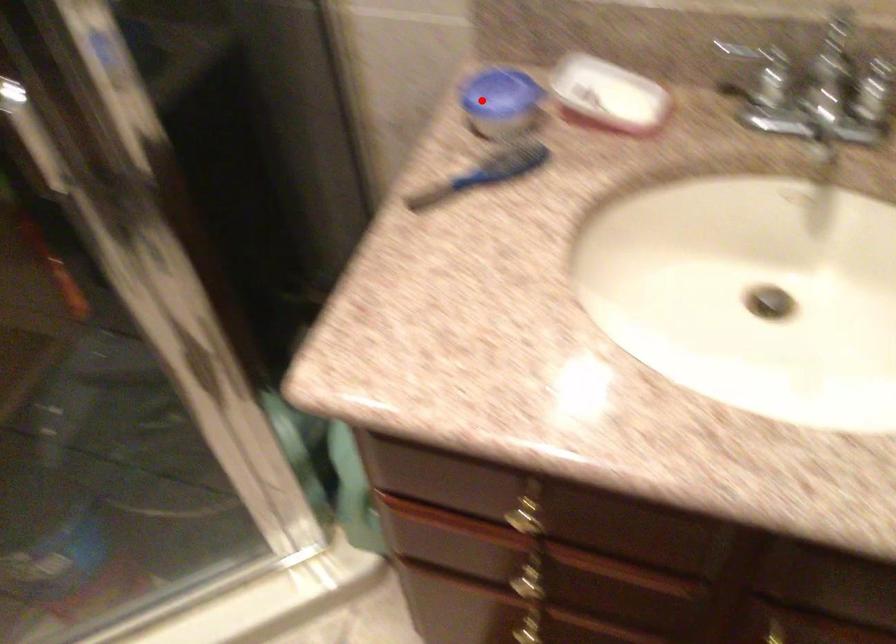
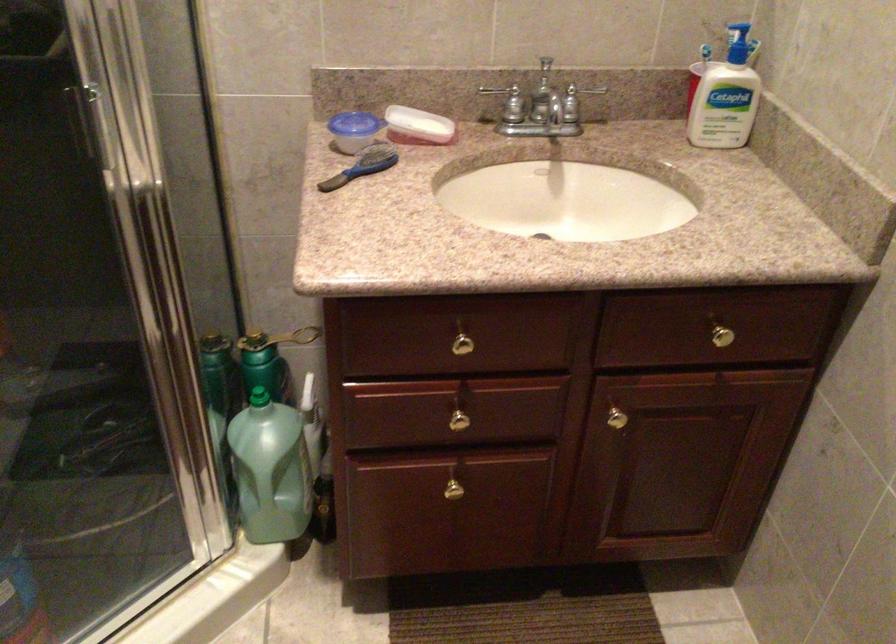
Find the pixel in the second image that matches the highlighted location in the first image.

(343, 126)